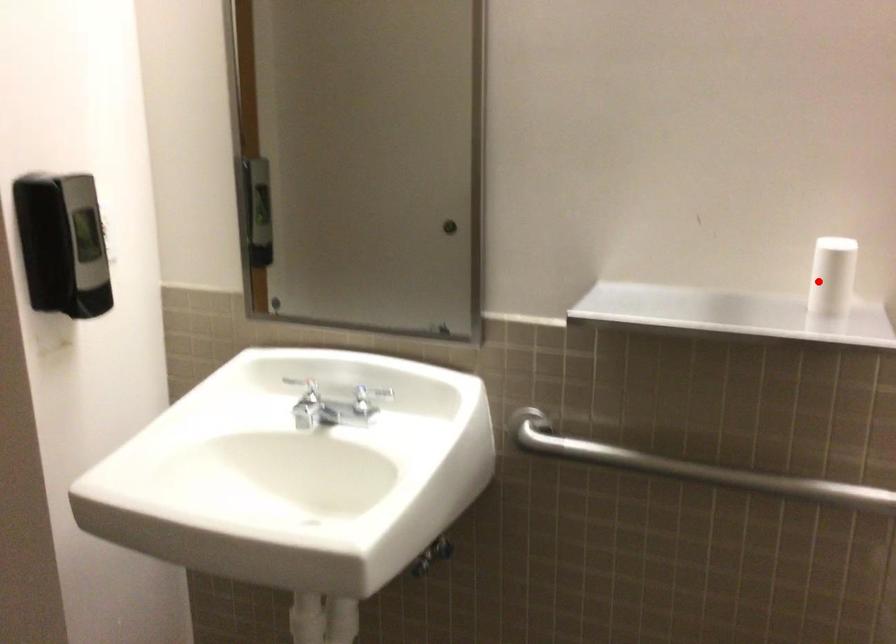
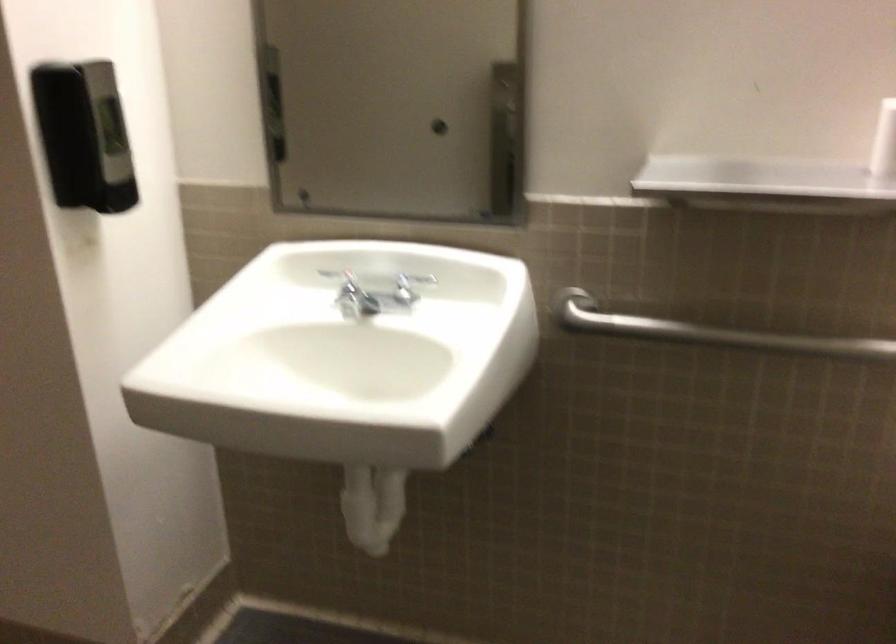
Find the pixel in the second image that matches the highlighted location in the first image.

(883, 142)